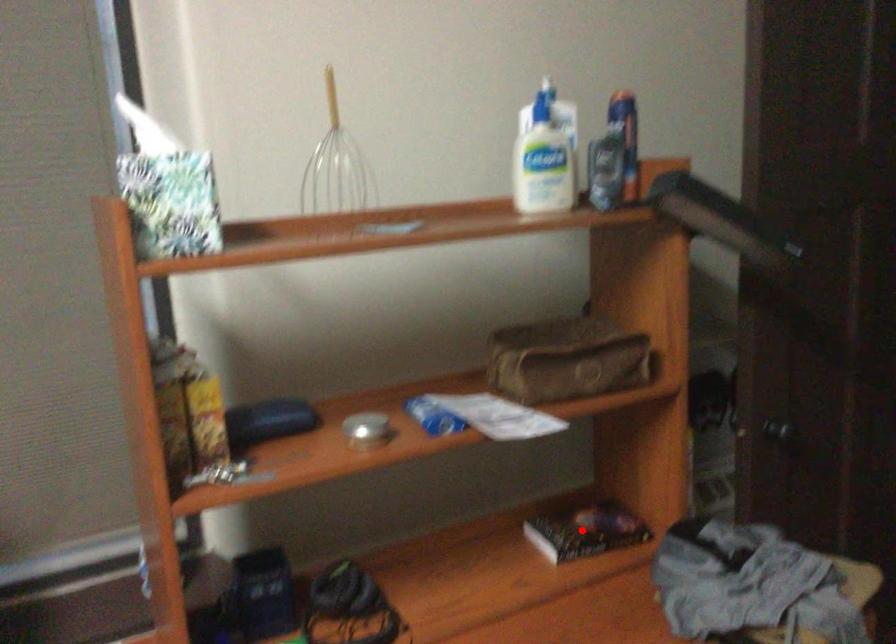
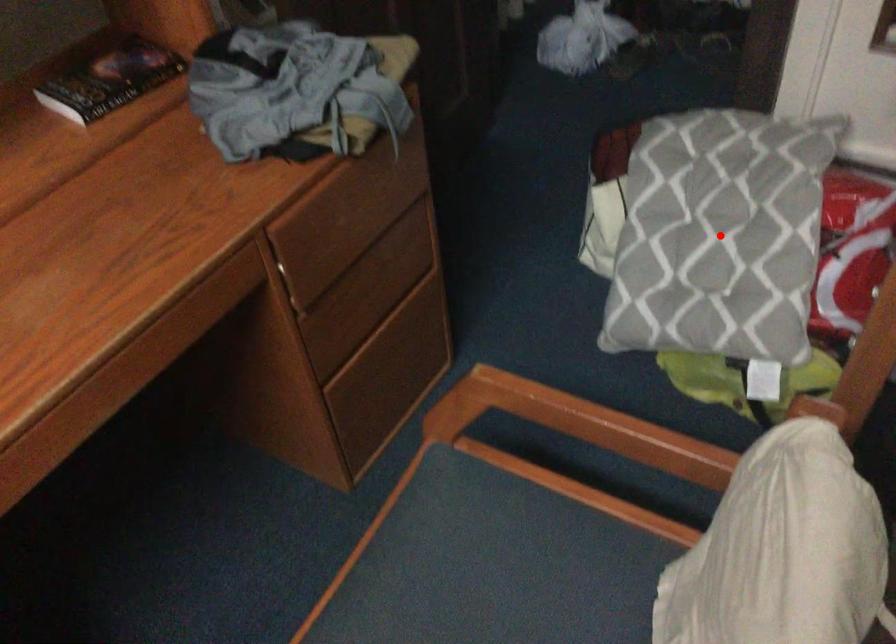
I am providing you with two images of the same scene from different viewpoints. A red point is marked on the first image and another point is marked on the second image. Is the marked point in image1 the same physical position as the marked point in image2?

No